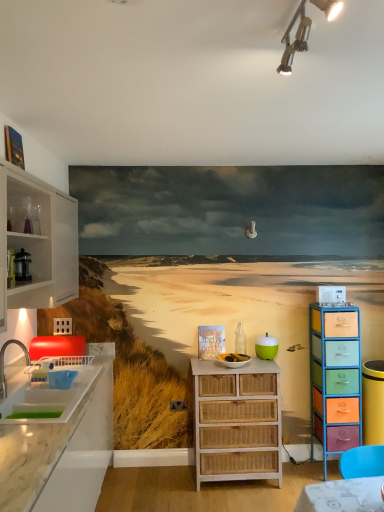
You are a GUI agent. You are given a task and a screenshot of the screen. Output one action in this format:
    pyautogui.click(x=<x>, y=<y>)
    Task: Click on the marble countertop at left
    Image resolution: width=384 pixels, height=512 pixels.
    Given the screenshot: What is the action you would take?
    pyautogui.click(x=62, y=451)

Based on the photo, what is the approximate width of white wicker chest of drawers at center, positioned as the second chest of drawers in right-to-left order?

The width of white wicker chest of drawers at center, positioned as the second chest of drawers in right-to-left order, is 18.29 inches.

Locate an element on the screen. The image size is (384, 512). multicolored wicker chest of drawers at right, arranged as the second chest of drawers when viewed from the left is located at coordinates (335, 378).

I want to click on green matte apple at center, so click(266, 347).

Considering the relative sizes of white glass cabinet at left and metallic track lighting at upper center in the image provided, is white glass cabinet at left shorter than metallic track lighting at upper center?

Incorrect, the height of white glass cabinet at left does not fall short of that of metallic track lighting at upper center.

From the image's perspective, is white glass cabinet at left under metallic track lighting at upper center?

→ Yes, from the image's perspective, white glass cabinet at left is below metallic track lighting at upper center.

Is the position of white glass cabinet at left more distant than that of metallic track lighting at upper center?

Yes, white glass cabinet at left is further from the viewer.

How far apart are white glass cabinet at left and metallic track lighting at upper center?

white glass cabinet at left is 1.75 meters away from metallic track lighting at upper center.

Is metallic track lighting at upper center facing towards multicolored wicker chest of drawers at right, arranged as the second chest of drawers when viewed from the left?

No, metallic track lighting at upper center is not aimed at multicolored wicker chest of drawers at right, arranged as the second chest of drawers when viewed from the left.

Does metallic track lighting at upper center appear on the right side of multicolored wicker chest of drawers at right, marked as the first chest of drawers in a right-to-left arrangement?

In fact, metallic track lighting at upper center is to the left of multicolored wicker chest of drawers at right, marked as the first chest of drawers in a right-to-left arrangement.

From the image's perspective, is metallic track lighting at upper center above multicolored wicker chest of drawers at right, arranged as the second chest of drawers when viewed from the left?

Yes, from the image's perspective, metallic track lighting at upper center is above multicolored wicker chest of drawers at right, arranged as the second chest of drawers when viewed from the left.

Is white wicker basket at center, the 3th appliance from the top, further to the viewer compared to metallic silver coffee pot at left, acting as the first appliance starting from the left?

Yes, the depth of white wicker basket at center, the 3th appliance from the top, is greater than that of metallic silver coffee pot at left, acting as the first appliance starting from the left.

Does white wicker basket at center, placed as the first appliance when sorted from bottom to top, have a lesser height compared to metallic silver coffee pot at left, which ranks as the first appliance in front-to-back order?

Yes.

Who is smaller, white wicker basket at center, the second appliance in the back-to-front sequence, or metallic silver coffee pot at left, the 1th appliance when ordered from top to bottom?

With smaller size is metallic silver coffee pot at left, the 1th appliance when ordered from top to bottom.

Consider the image. From the image's perspective, relative to metallic silver coffee pot at left, arranged as the 3th appliance when viewed from the right, is white wicker basket at center, the 3th appliance from the top, above or below?

Clearly, from the image's perspective, white wicker basket at center, the 3th appliance from the top, is below metallic silver coffee pot at left, arranged as the 3th appliance when viewed from the right.

Would you say white glass cabinet at left is outside multicolored wicker chest of drawers at right, arranged as the second chest of drawers when viewed from the left?

Yes, white glass cabinet at left is not within multicolored wicker chest of drawers at right, arranged as the second chest of drawers when viewed from the left.

From a real-world perspective, does white glass cabinet at left sit lower than multicolored wicker chest of drawers at right, marked as the first chest of drawers in a right-to-left arrangement?

No, from a real-world perspective, white glass cabinet at left is not beneath multicolored wicker chest of drawers at right, marked as the first chest of drawers in a right-to-left arrangement.

Can you confirm if white glass cabinet at left is shorter than multicolored wicker chest of drawers at right, arranged as the second chest of drawers when viewed from the left?

Correct, white glass cabinet at left is not as tall as multicolored wicker chest of drawers at right, arranged as the second chest of drawers when viewed from the left.

Who is smaller, white glass cabinet at left or multicolored wicker chest of drawers at right, arranged as the second chest of drawers when viewed from the left?

multicolored wicker chest of drawers at right, arranged as the second chest of drawers when viewed from the left, is smaller.

What's the angular difference between white glossy sink at left and white glass cabinet at left's facing directions?

0.128 degrees separate the facing orientations of white glossy sink at left and white glass cabinet at left.

Where is `sink located behind the white glass cabinet at left`? The image size is (384, 512). sink located behind the white glass cabinet at left is located at coordinates (48, 393).

Is there a large distance between white glossy sink at left and white glass cabinet at left?

white glossy sink at left is actually quite close to white glass cabinet at left.

Which of these two, white glossy sink at left or white glass cabinet at left, stands taller?

white glass cabinet at left.

Between green matte apple at center and white glossy sink at left, which one appears on the left side from the viewer's perspective?

Positioned to the left is white glossy sink at left.

Does point (275, 355) appear closer or farther from the camera than point (0, 402)?

Point (275, 355) is positioned farther from the camera compared to point (0, 402).

Can you confirm if green matte apple at center is shorter than white glossy sink at left?

Indeed, green matte apple at center has a lesser height compared to white glossy sink at left.

Is white plastic microwave at upper right, which is counted as the second appliance, starting from the top, taller than white wicker chest of drawers at center, acting as the first chest of drawers starting from the left?

Incorrect, the height of white plastic microwave at upper right, which is counted as the second appliance, starting from the top, is not larger of that of white wicker chest of drawers at center, acting as the first chest of drawers starting from the left.

In terms of size, does white plastic microwave at upper right, which is the 1th appliance from right to left, appear bigger or smaller than white wicker chest of drawers at center, acting as the first chest of drawers starting from the left?

In the image, white plastic microwave at upper right, which is the 1th appliance from right to left, appears to be smaller than white wicker chest of drawers at center, acting as the first chest of drawers starting from the left.

What's the angular difference between white plastic microwave at upper right, which is counted as the second appliance, starting from the top, and white wicker chest of drawers at center, positioned as the second chest of drawers in right-to-left order,'s facing directions?

2.54 degrees.

Can you confirm if white plastic microwave at upper right, acting as the 2th appliance starting from the bottom, is wider than white wicker chest of drawers at center, positioned as the second chest of drawers in right-to-left order?

Incorrect, the width of white plastic microwave at upper right, acting as the 2th appliance starting from the bottom, does not surpass that of white wicker chest of drawers at center, positioned as the second chest of drawers in right-to-left order.

This screenshot has height=512, width=384. What are the coordinates of `light fixture in front of the white glass cabinet at left` in the screenshot? It's located at (295, 40).

From the metallic track lighting at upper center, count 2nd chest of drawerss backward and point to it. Please provide its 2D coordinates.

[(335, 378)]

Estimate the real-world distances between objects in this image. Which object is closer to white glass cabinet at left, marble countertop at left or green matte apple at center?

Based on the image, marble countertop at left appears to be nearer to white glass cabinet at left.

Which object lies nearer to the anchor point green matte apple at center, white plastic microwave at upper right, which is counted as the second appliance, starting from the top, or white glossy sink at left?

white plastic microwave at upper right, which is counted as the second appliance, starting from the top, is closer to green matte apple at center.

Based on the photo, based on their spatial positions, is white wicker chest of drawers at center, acting as the first chest of drawers starting from the left, or metallic silver coffee pot at left, arranged as the 3th appliance when viewed from the right, further from marble countertop at left?

The object further to marble countertop at left is metallic silver coffee pot at left, arranged as the 3th appliance when viewed from the right.

Based on their spatial positions, is metallic track lighting at upper center or white wicker chest of drawers at center, positioned as the second chest of drawers in right-to-left order, closer to metallic silver coffee pot at left, which ranks as the first appliance in front-to-back order?

Among the two, white wicker chest of drawers at center, positioned as the second chest of drawers in right-to-left order, is located nearer to metallic silver coffee pot at left, which ranks as the first appliance in front-to-back order.

Which object lies nearer to the anchor point white plastic microwave at upper right, the 3th appliance from the left, white wicker chest of drawers at center, positioned as the second chest of drawers in right-to-left order, or green matte apple at center?

green matte apple at center.

Based on their spatial positions, is white glossy sink at left or white plastic microwave at upper right, which is counted as the second appliance, starting from the top, further from multicolored wicker chest of drawers at right, marked as the first chest of drawers in a right-to-left arrangement?

white glossy sink at left.

Which object lies nearer to the anchor point green matte apple at center, metallic silver coffee pot at left, acting as the first appliance starting from the left, or white glass cabinet at left?

white glass cabinet at left lies closer to green matte apple at center than the other object.

Considering their positions, is white glossy sink at left positioned further to metallic silver coffee pot at left, the 1th appliance when ordered from top to bottom, than marble countertop at left?

marble countertop at left is positioned further to the anchor metallic silver coffee pot at left, the 1th appliance when ordered from top to bottom.

Identify the location of cabinetry between marble countertop at left and white wicker basket at center, which appears as the second appliance when viewed from the front, along the z-axis. (37, 241).

At what (x,y) coordinates should I click in order to perform the action: click on teal between metallic silver coffee pot at left, arranged as the 3th appliance when viewed from the right, and white plastic microwave at upper right, acting as the 2th appliance starting from the bottom. Please return your answer as a coordinate pair (x, y). This screenshot has height=512, width=384. Looking at the image, I should click on (266, 347).

I want to click on cabinetry between metallic silver coffee pot at left, acting as the first appliance starting from the left, and green matte apple at center, so click(37, 241).

Image resolution: width=384 pixels, height=512 pixels. Find the location of `cabinetry between metallic track lighting at upper center and multicolored wicker chest of drawers at right, marked as the first chest of drawers in a right-to-left arrangement, in the front-back direction`. cabinetry between metallic track lighting at upper center and multicolored wicker chest of drawers at right, marked as the first chest of drawers in a right-to-left arrangement, in the front-back direction is located at coordinates (37, 241).